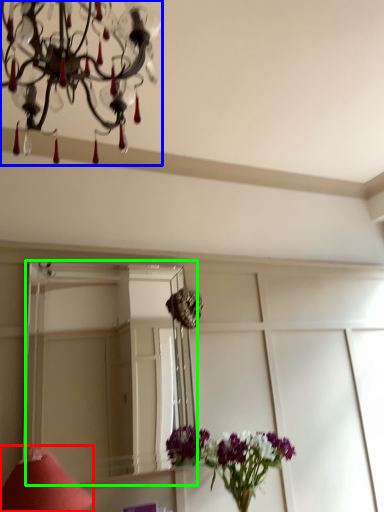
Question: Estimate the real-world distances between objects in this image. Which object is closer to table lamp (highlighted by a red box), lamp (highlighted by a blue box) or mirror (highlighted by a green box)?

Choices:
 (A) lamp
 (B) mirror

Answer: (A)